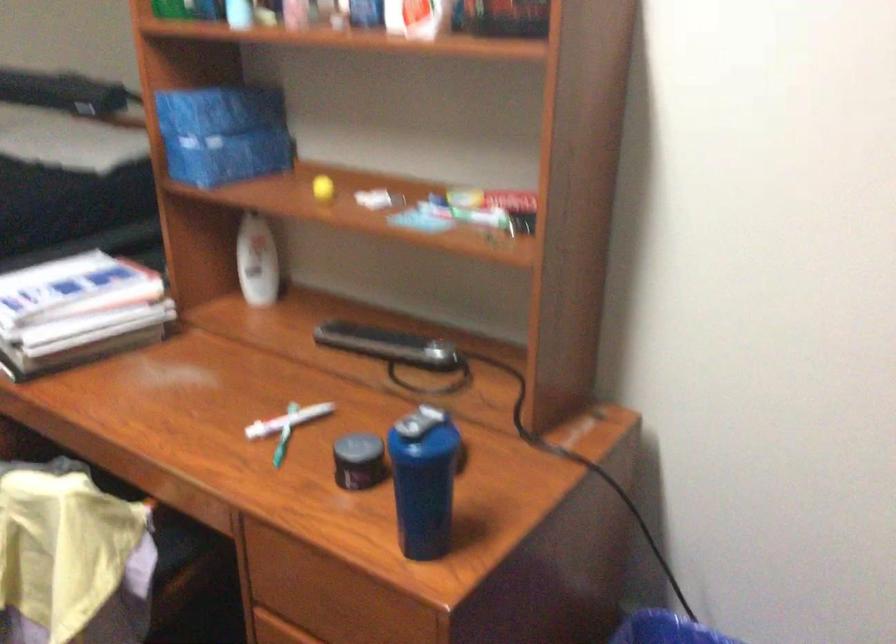
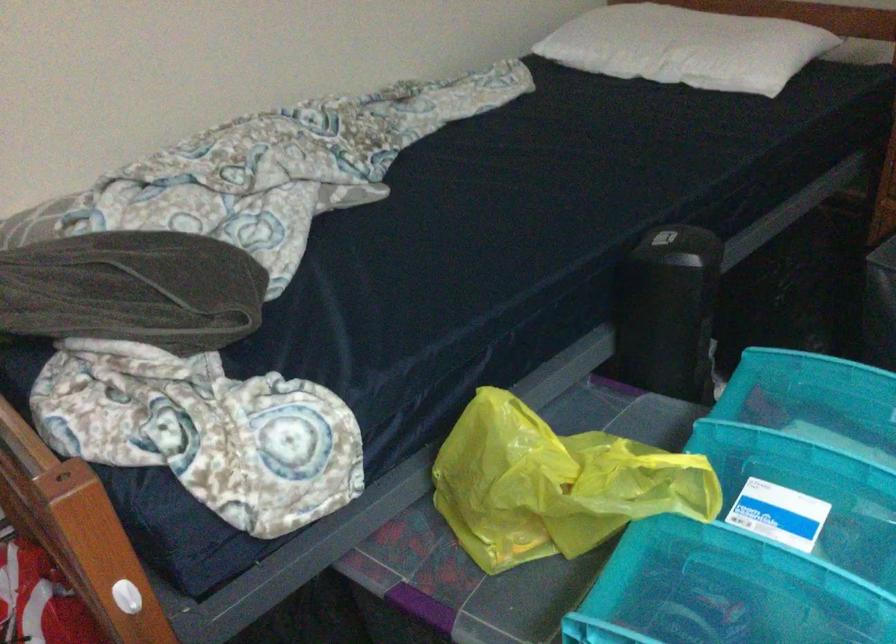
In a continuous first-person perspective shot, in which direction is the camera moving?

The cameraman moved toward left, forward.